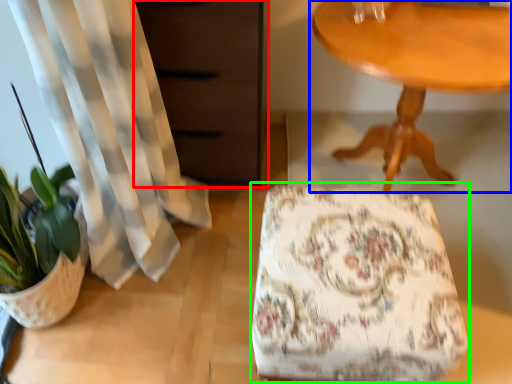
Question: Which object is positioned farthest from dresser (highlighted by a red box)? Select from table (highlighted by a blue box) and rocking chair (highlighted by a green box).

Choices:
 (A) table
 (B) rocking chair

Answer: (B)